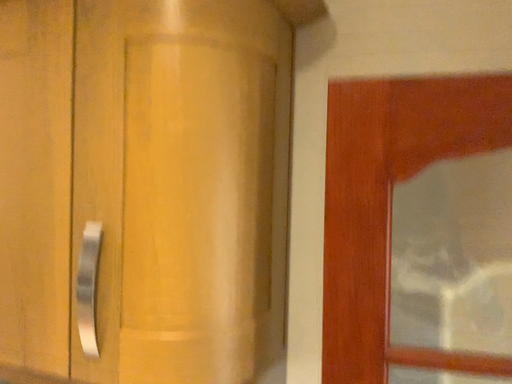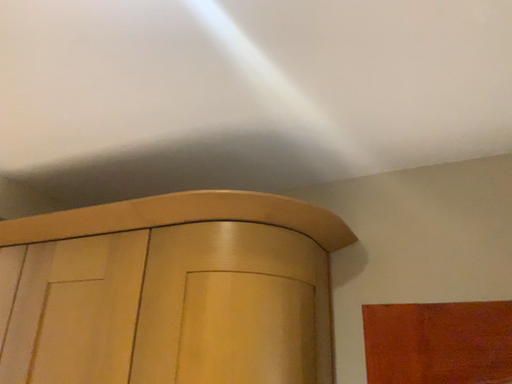
Question: How did the camera likely rotate when shooting the video?

Choices:
 (A) rotated upward
 (B) rotated downward

Answer: (A)